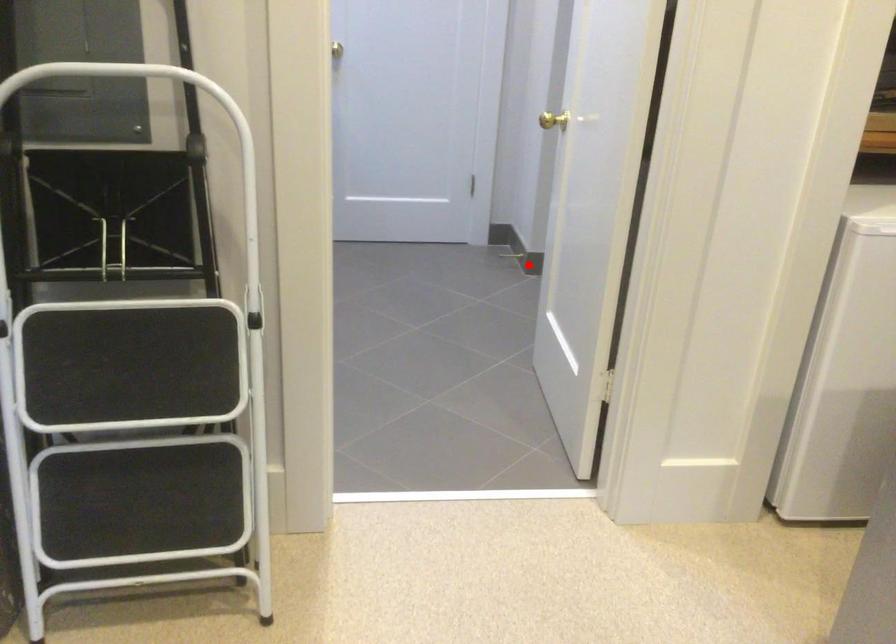
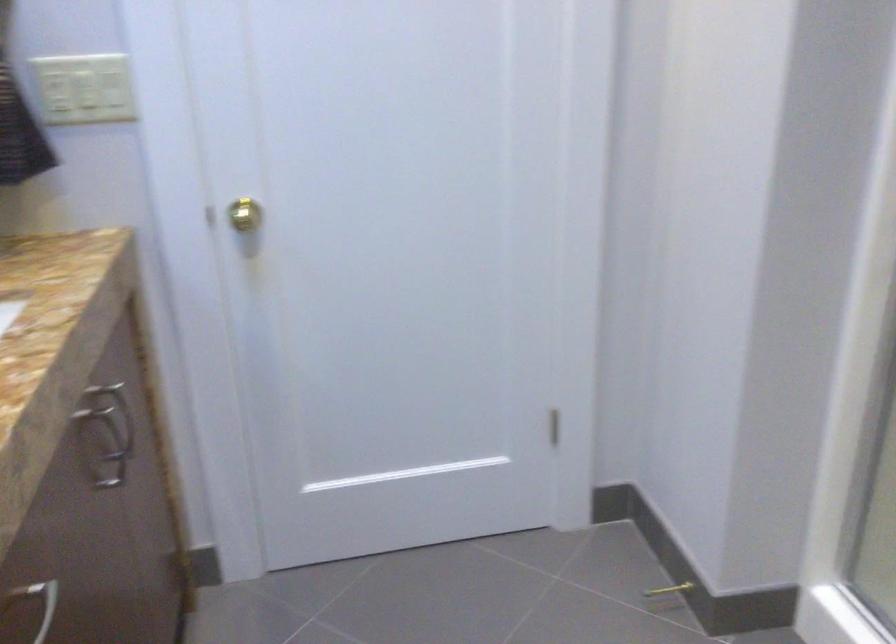
Where in the second image is the point corresponding to the highlighted location from the first image?

(666, 596)